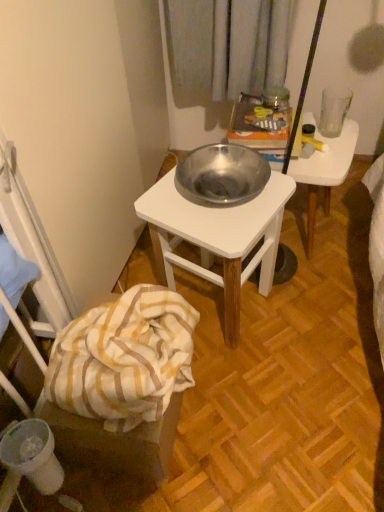
Question: Does yellow striped fabric at lower left contain metallic silver bowl at center?

Choices:
 (A) yes
 (B) no

Answer: (B)

Question: From a real-world perspective, is yellow striped fabric at lower left under metallic silver bowl at center?

Choices:
 (A) yes
 (B) no

Answer: (A)

Question: From the image's perspective, is yellow striped fabric at lower left below metallic silver bowl at center?

Choices:
 (A) yes
 (B) no

Answer: (A)

Question: Does yellow striped fabric at lower left turn towards metallic silver bowl at center?

Choices:
 (A) yes
 (B) no

Answer: (B)

Question: Can you confirm if yellow striped fabric at lower left is positioned to the left of metallic silver bowl at center?

Choices:
 (A) yes
 (B) no

Answer: (A)

Question: In the image, is yellow striped fabric at lower left positioned in front of or behind metallic white table at center?

Choices:
 (A) behind
 (B) front

Answer: (B)

Question: Is yellow striped fabric at lower left wider or thinner than metallic white table at center?

Choices:
 (A) wide
 (B) thin

Answer: (B)

Question: Would you say yellow striped fabric at lower left is to the left or to the right of metallic white table at center in the picture?

Choices:
 (A) right
 (B) left

Answer: (B)

Question: Is yellow striped fabric at lower left situated inside metallic white table at center or outside?

Choices:
 (A) outside
 (B) inside

Answer: (A)

Question: Considering the relative positions of metallic white table at center and white striped fabric at lower left in the image provided, is metallic white table at center to the left or to the right of white striped fabric at lower left?

Choices:
 (A) left
 (B) right

Answer: (B)

Question: Is point (228, 310) closer or farther from the camera than point (105, 393)?

Choices:
 (A) closer
 (B) farther

Answer: (B)

Question: From the image's perspective, is metallic white table at center positioned above or below white striped fabric at lower left?

Choices:
 (A) below
 (B) above

Answer: (B)

Question: Relative to white striped fabric at lower left, is metallic white table at center in front or behind?

Choices:
 (A) front
 (B) behind

Answer: (B)

Question: Considering the positions of metallic white table at center and yellow striped fabric at lower left in the image, is metallic white table at center bigger or smaller than yellow striped fabric at lower left?

Choices:
 (A) small
 (B) big

Answer: (B)

Question: Is point (263, 227) closer or farther from the camera than point (170, 450)?

Choices:
 (A) farther
 (B) closer

Answer: (B)